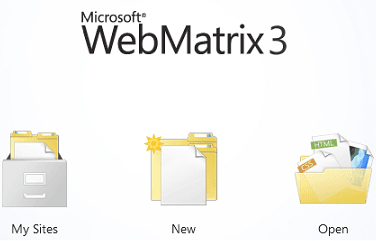
The width and height of the screenshot is (376, 241). I want to click on icon looking like a filing cabinet, so click(35, 184).